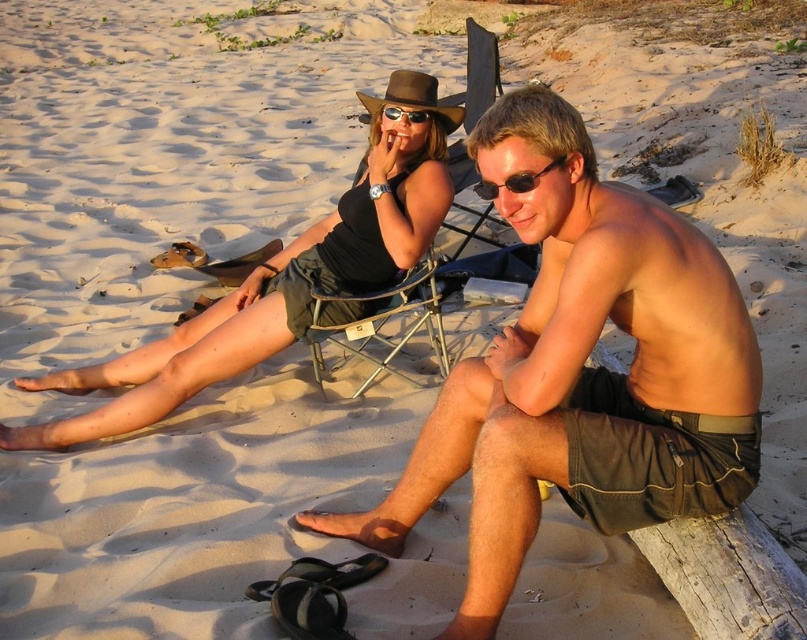
Question: Is matte black tank top at upper center in front of brown felt cowboy hat at upper center?

Choices:
 (A) yes
 (B) no

Answer: (A)

Question: Which object is the closest to the brown felt cowboy hat at upper center?

Choices:
 (A) metallic folding chair at center
 (B) matte black tank top at upper center

Answer: (B)

Question: Is matte black tank top at upper center further to camera compared to metallic folding chair at center?

Choices:
 (A) yes
 (B) no

Answer: (B)

Question: Which of the following is the farthest from the observer?

Choices:
 (A) (410, 180)
 (B) (456, 104)
 (C) (640, 310)
 (D) (366, 106)

Answer: (B)

Question: Does matte black shorts at center have a larger size compared to matte black sunglasses at center?

Choices:
 (A) no
 (B) yes

Answer: (B)

Question: Which of the following is the closest to the observer?

Choices:
 (A) matte black sunglasses at center
 (B) matte black shorts at center

Answer: (B)